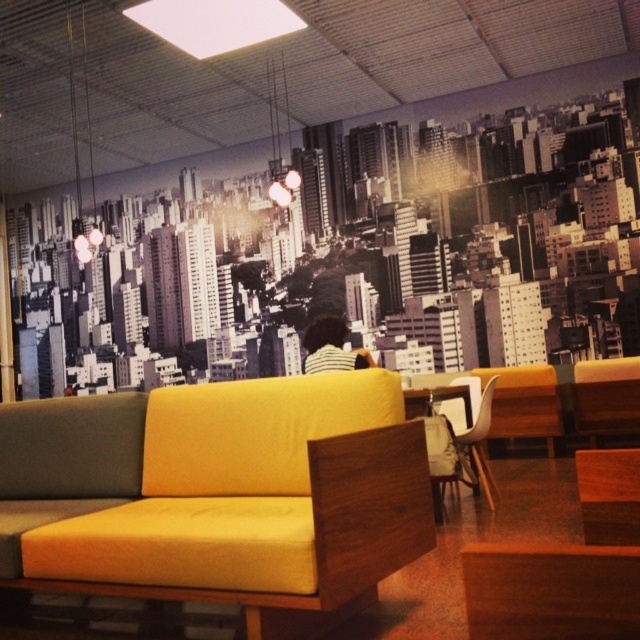
You are standing in the lounge and need to locate the white plastic chair at lower right. According to the coordinates provided, where should you look?

You should look at point (470, 454) to find the white plastic chair at lower right.

You are standing in the lounge and want to sit down. You see the white plastic chair at lower right and the white striped shirt at center. Which one is closer to you?

The white plastic chair at lower right is closer to you because it is further to the viewer than the white striped shirt at center.